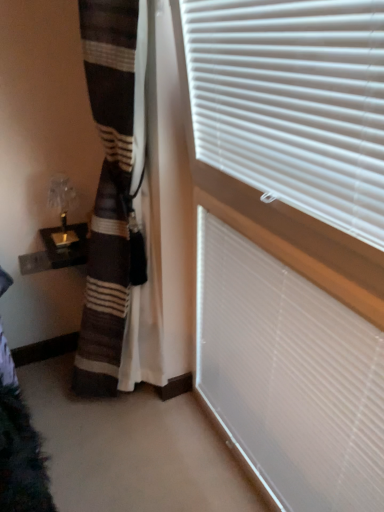
Question: Looking at their shapes, would you say white matte window blind at upper right, which is counted as the 2th window blind, starting from the top, is wider or thinner than white plastic blinds at upper right, acting as the second window blind starting from the bottom?

Choices:
 (A) wide
 (B) thin

Answer: (B)

Question: Based on their positions, is white matte window blind at upper right, positioned as the first window blind in bottom-to-top order, located to the left or right of white plastic blinds at upper right, acting as the second window blind starting from the bottom?

Choices:
 (A) left
 (B) right

Answer: (B)

Question: From a real-world perspective, is white matte window blind at upper right, positioned as the first window blind in bottom-to-top order, above or below white plastic blinds at upper right, acting as the second window blind starting from the bottom?

Choices:
 (A) above
 (B) below

Answer: (B)

Question: From a real-world perspective, is white plastic blinds at upper right, acting as the second window blind starting from the bottom, positioned above or below white matte window blind at upper right, which is counted as the 2th window blind, starting from the top?

Choices:
 (A) below
 (B) above

Answer: (B)

Question: From the image's perspective, is white plastic blinds at upper right, which ranks as the 1th window blind in top-to-bottom order, located above or below white matte window blind at upper right, which is counted as the 2th window blind, starting from the top?

Choices:
 (A) below
 (B) above

Answer: (B)

Question: Do you think white plastic blinds at upper right, acting as the second window blind starting from the bottom, is within white matte window blind at upper right, which is counted as the 2th window blind, starting from the top, or outside of it?

Choices:
 (A) outside
 (B) inside

Answer: (A)

Question: Relative to white matte window blind at upper right, positioned as the first window blind in bottom-to-top order, is white plastic blinds at upper right, acting as the second window blind starting from the bottom, in front or behind?

Choices:
 (A) behind
 (B) front

Answer: (B)